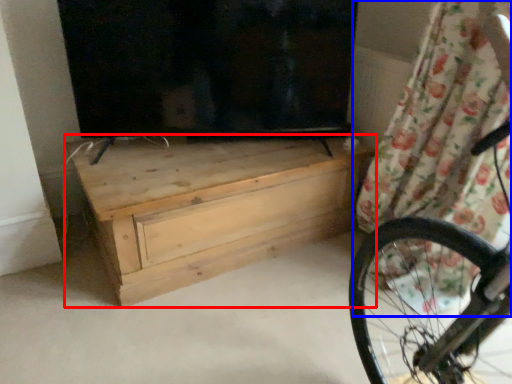
Question: Which object appears farthest to the camera in this image, chest of drawers (highlighted by a red box) or curtain (highlighted by a blue box)?

Choices:
 (A) chest of drawers
 (B) curtain

Answer: (A)